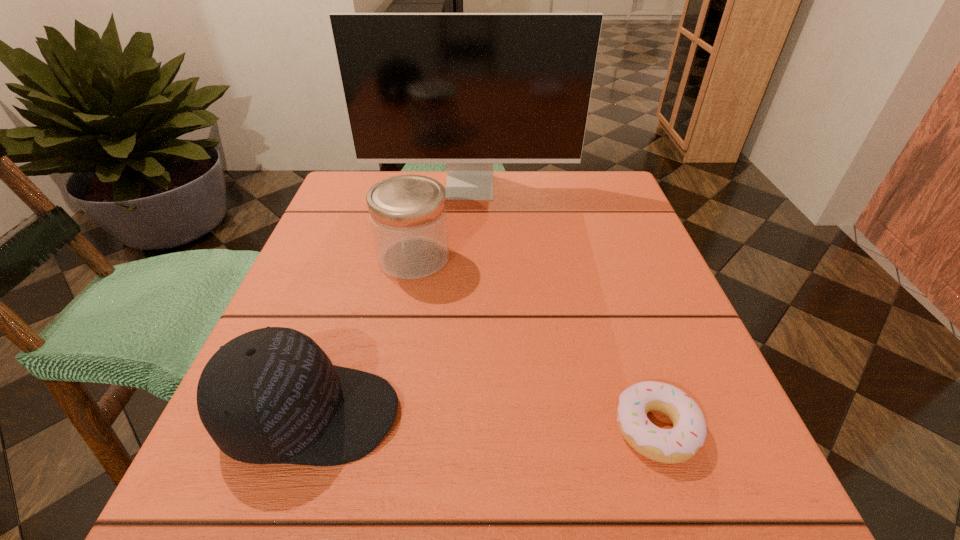
Locate an element on the screen. The width and height of the screenshot is (960, 540). object that is at the near right corner is located at coordinates (679, 444).

In order to click on vacant space at the far edge of the desktop in this screenshot , I will do `click(514, 218)`.

The width and height of the screenshot is (960, 540). I want to click on vacant space at the left edge of the desktop, so (x=351, y=246).

In the image, there is a desktop. Where is `free space at the right edge`? The width and height of the screenshot is (960, 540). free space at the right edge is located at coordinates (740, 433).

In the image, there is a desktop. Where is `vacant area at the far left corner`? vacant area at the far left corner is located at coordinates (341, 191).

In the image, there is a desktop. Where is `vacant area at the near left corner`? The image size is (960, 540). vacant area at the near left corner is located at coordinates (275, 491).

In the image, there is a desktop. Identify the location of vacant space at the far right corner. This screenshot has width=960, height=540. (604, 189).

Find the location of `free space at the near right corner of the desktop`. free space at the near right corner of the desktop is located at coordinates (790, 520).

You are a GUI agent. You are given a task and a screenshot of the screen. Output one action in this format:
    pyautogui.click(x=<x>, y=<y>)
    Task: Click on the empty location between the doughnut and the baseball cap
    The height and width of the screenshot is (540, 960).
    Given the screenshot: What is the action you would take?
    pyautogui.click(x=484, y=422)

I want to click on free space between the baseball cap and the farthest object, so point(391,301).